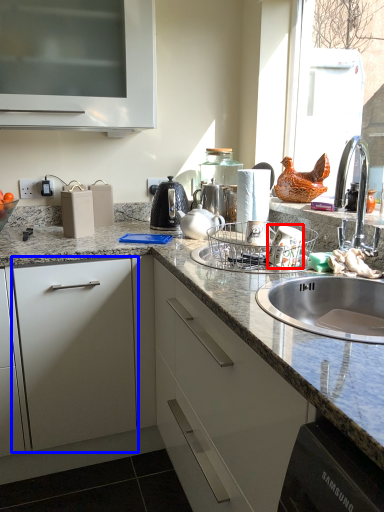
Question: Which object is closer to the camera taking this photo, appliance (highlighted by a red box) or drawer (highlighted by a blue box)?

Choices:
 (A) appliance
 (B) drawer

Answer: (A)